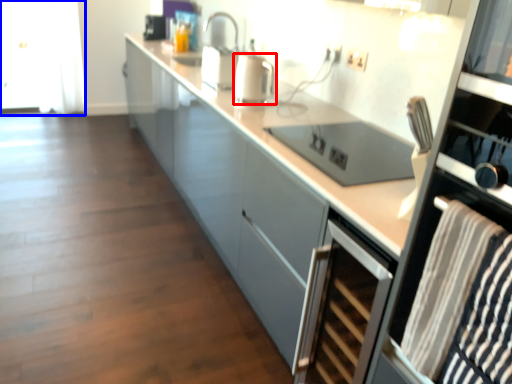
Question: Among these objects, which one is farthest to the camera, kitchen appliance (highlighted by a red box) or glass door (highlighted by a blue box)?

Choices:
 (A) kitchen appliance
 (B) glass door

Answer: (B)